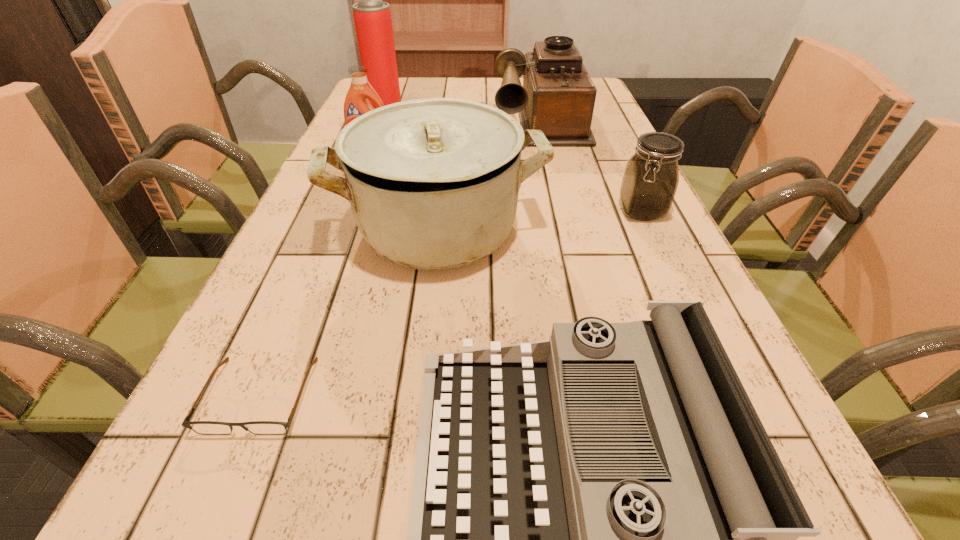
Where is `the tallest object`? The image size is (960, 540). the tallest object is located at coordinates (372, 17).

This screenshot has width=960, height=540. I want to click on saucepan, so click(433, 183).

The height and width of the screenshot is (540, 960). What are the coordinates of `phonograph_record` in the screenshot? It's located at (558, 96).

The height and width of the screenshot is (540, 960). I want to click on detergent, so click(356, 103).

Locate an element on the screen. the third shortest object is located at coordinates (649, 184).

This screenshot has width=960, height=540. I want to click on spectacles, so click(200, 427).

At what (x,y) coordinates should I click in order to perform the action: click on vacant space located on the back of the aerosol can. Please return your answer as a coordinate pair (x, y). The width and height of the screenshot is (960, 540). Looking at the image, I should click on (x=395, y=85).

Image resolution: width=960 pixels, height=540 pixels. I want to click on vacant space located on the back of the saucepan, so click(x=451, y=117).

Identify the location of free region located on the horn of the phonograph_record. The image size is (960, 540). (556, 186).

I want to click on free point located 0.110m on the front-facing side of the detergent, so click(x=362, y=176).